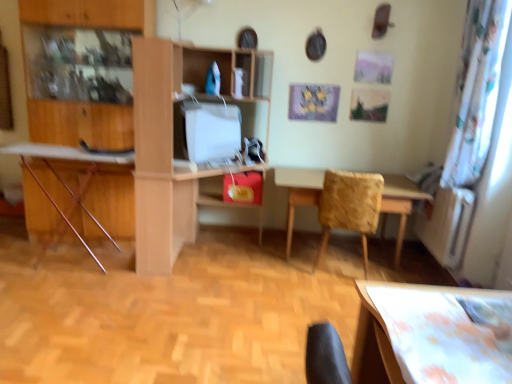
Where is `vacant space in front of light wood/wooden desk at center`? Image resolution: width=512 pixels, height=384 pixels. vacant space in front of light wood/wooden desk at center is located at coordinates (172, 303).